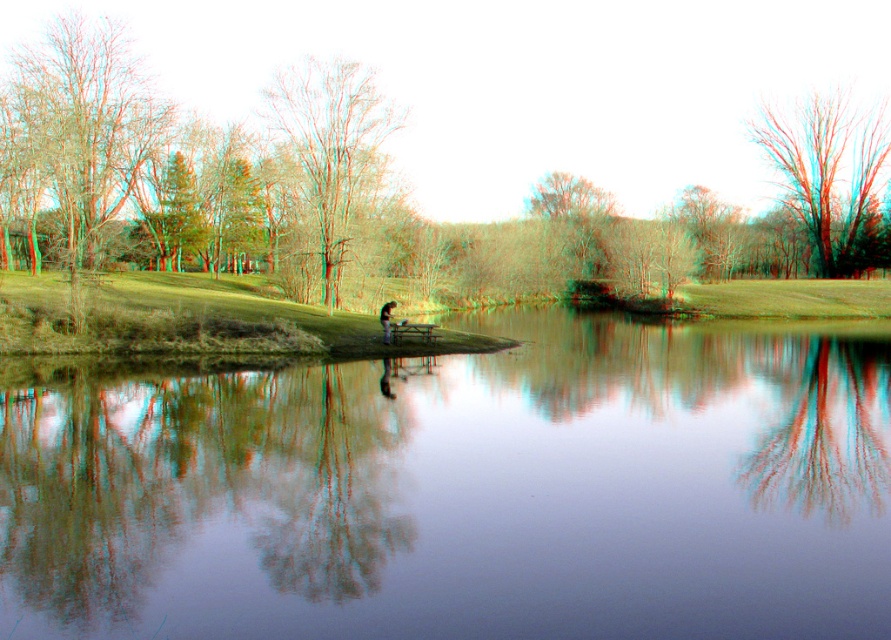
Question: Which of the following is the farthest from the observer?

Choices:
 (A) (759, 125)
 (B) (451, 419)
 (C) (398, 84)

Answer: (C)

Question: Is transparent glass water at center smaller than dark brown wooden bench at center?

Choices:
 (A) no
 (B) yes

Answer: (A)

Question: Which point is closer to the camera?

Choices:
 (A) smooth brown tree at center
 (B) smooth bark tree at upper right

Answer: (A)

Question: Can you confirm if green matte tree at center is positioned to the right of smooth brown tree at center?

Choices:
 (A) yes
 (B) no

Answer: (A)

Question: Does green matte tree at center have a larger size compared to smooth brown tree at center?

Choices:
 (A) no
 (B) yes

Answer: (B)

Question: Which point is farther from the camera taking this photo?

Choices:
 (A) (648, 340)
 (B) (387, 340)

Answer: (A)